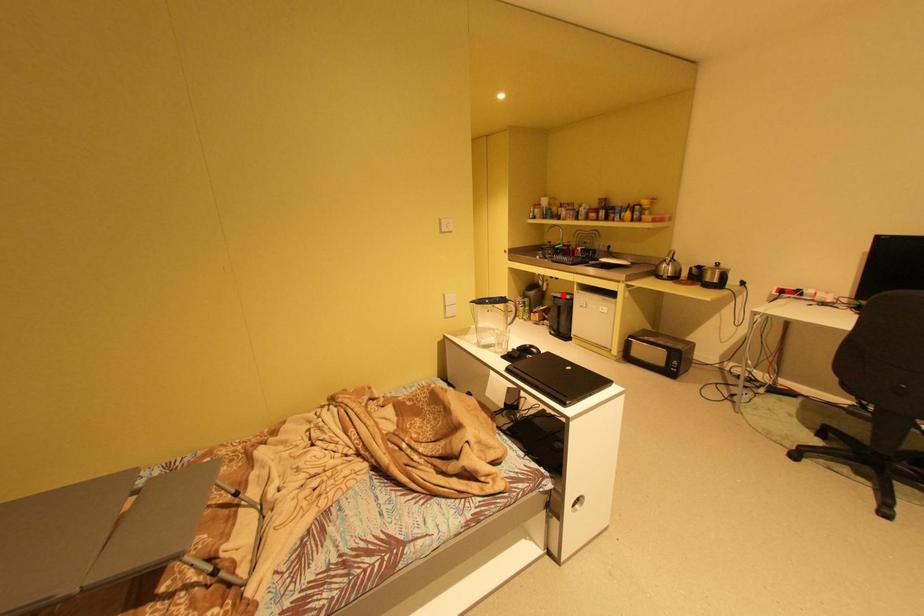
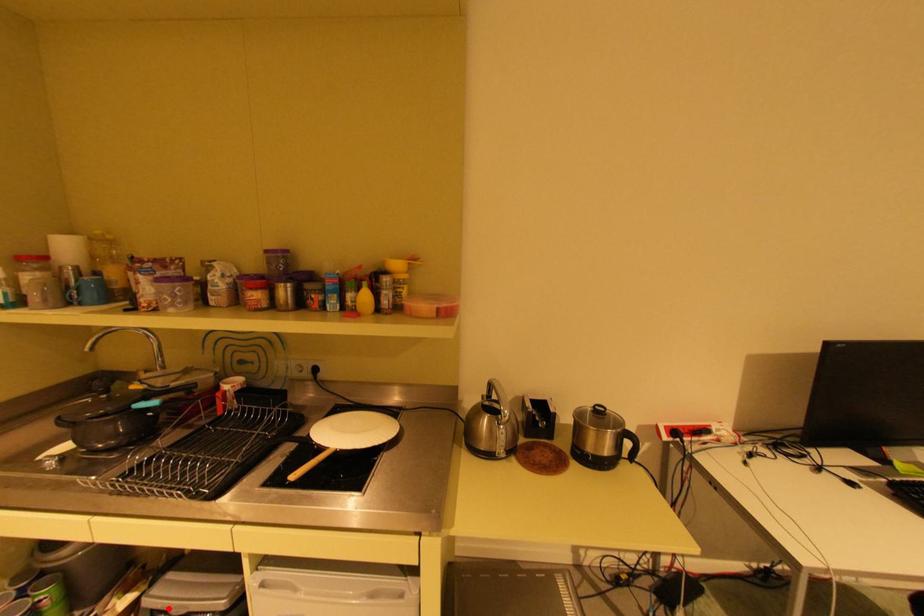
I am providing you with two images of the same scene from different viewpoints. A red point is marked on the first image and another point is marked on the second image. Do the highlighted points in image1 and image2 indicate the same real-world spot?

Yes